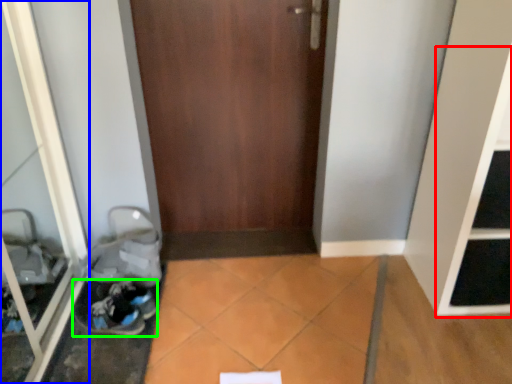
Question: Estimate the real-world distances between objects in this image. Which object is farther from shelf (highlighted by a red box), glass door (highlighted by a blue box) or footwear (highlighted by a green box)?

Choices:
 (A) glass door
 (B) footwear

Answer: (A)